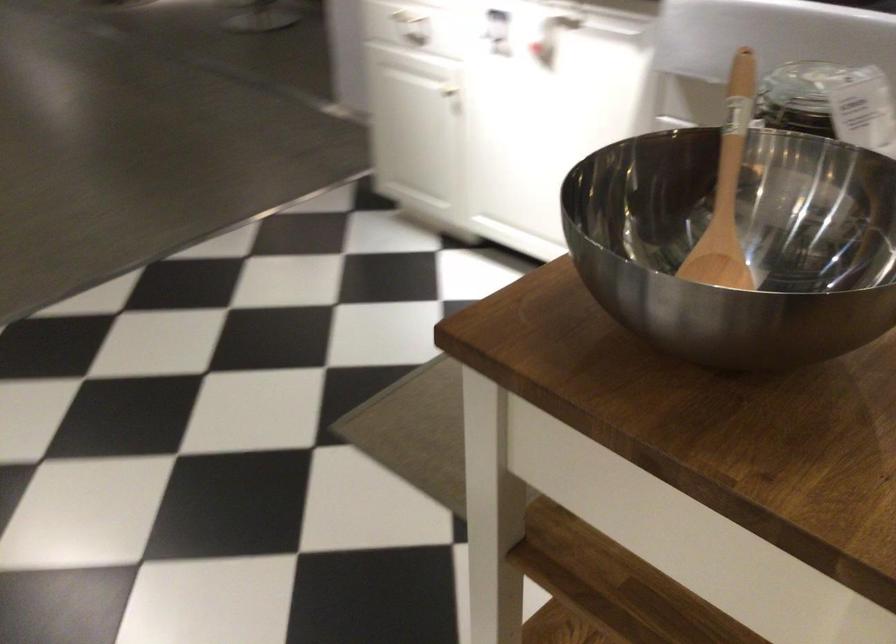
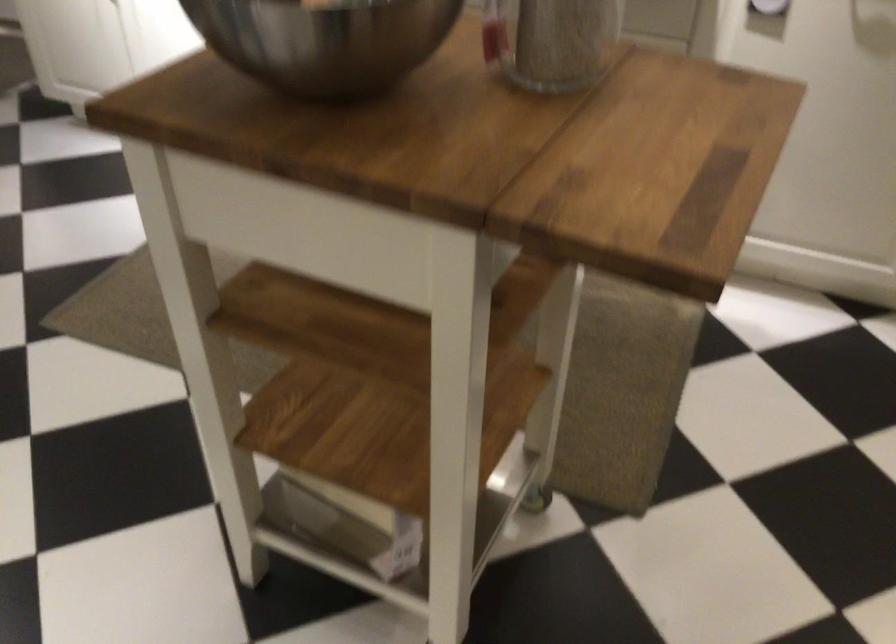
Question: The camera is either moving clockwise (left) or counter-clockwise (right) around the object. The first image is from the beginning of the video and the second image is from the end. Is the camera moving left or right when shooting the video?

Choices:
 (A) Left
 (B) Right

Answer: (A)